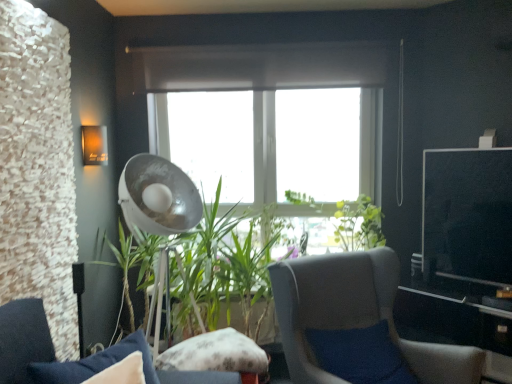
This screenshot has width=512, height=384. Identify the location of metallic silver fan at center. (158, 197).

Where is `matte orange wall sconce at upper left`? Image resolution: width=512 pixels, height=384 pixels. matte orange wall sconce at upper left is located at coordinates (94, 145).

Where is `fluffy fabric pillow at center`? Image resolution: width=512 pixels, height=384 pixels. fluffy fabric pillow at center is located at coordinates (215, 354).

The image size is (512, 384). What are the coordinates of `metallic silver fan at center` in the screenshot? It's located at (158, 197).

Can you confirm if gray fabric chair at center, the 2th chair when ordered from left to right, is positioned to the right of green leafy plant at center?

Indeed, gray fabric chair at center, the 2th chair when ordered from left to right, is positioned on the right side of green leafy plant at center.

From the picture: Does gray fabric chair at center, the 2th chair when ordered from left to right, have a greater width compared to green leafy plant at center?

Indeed, gray fabric chair at center, the 2th chair when ordered from left to right, has a greater width compared to green leafy plant at center.

The height and width of the screenshot is (384, 512). Identify the location of houseplant that is on the left side of gray fabric chair at center, the first chair when ordered from right to left. (210, 264).

Can you confirm if velvet blue cushion at lower left, the 2th chair from the right, is wider than metallic silver fan at center?

Incorrect, the width of velvet blue cushion at lower left, the 2th chair from the right, does not surpass that of metallic silver fan at center.

Where is `the 1st chair counting from the right of the metallic silver fan at center`? The height and width of the screenshot is (384, 512). the 1st chair counting from the right of the metallic silver fan at center is located at coordinates 72,361.

Relative to metallic silver fan at center, is velvet blue cushion at lower left, the 2th chair from the right, in front or behind?

velvet blue cushion at lower left, the 2th chair from the right, is positioned closer to the viewer than metallic silver fan at center.

Locate an element on the screen. pillow that appears in front of the metallic silver fan at center is located at coordinates (215, 354).

Would you say fluffy fabric pillow at center is a long distance from metallic silver fan at center?

No, fluffy fabric pillow at center is not far away from metallic silver fan at center.

Is fluffy fabric pillow at center wider than metallic silver fan at center?

No.

Measure the distance between metallic silver fan at center and matte orange wall sconce at upper left.

A distance of 20.07 inches exists between metallic silver fan at center and matte orange wall sconce at upper left.

Is point (155, 162) closer or farther from the camera than point (85, 126)?

Clearly, point (155, 162) is more distant from the camera than point (85, 126).

From a real-world perspective, is metallic silver fan at center physically located above or below matte orange wall sconce at upper left?

metallic silver fan at center is situated lower than matte orange wall sconce at upper left in the real world.

Is metallic silver fan at center positioned beyond the bounds of matte orange wall sconce at upper left?

metallic silver fan at center is positioned outside matte orange wall sconce at upper left.

From the image's perspective, who appears lower, matte orange wall sconce at upper left or metallic silver fan at center?

metallic silver fan at center, from the image's perspective.

Is matte orange wall sconce at upper left smaller than metallic silver fan at center?

Yes.

Identify the location of mechanical fan that appears in front of the matte orange wall sconce at upper left. (158, 197).

From a real-world perspective, between matte orange wall sconce at upper left and metallic silver fan at center, who is vertically lower?

metallic silver fan at center.

Which is closer, (472, 350) or (101, 133)?

Point (472, 350)

Which of these two, gray fabric chair at center, the first chair when ordered from right to left, or matte orange wall sconce at upper left, stands shorter?

matte orange wall sconce at upper left is shorter.

Is gray fabric chair at center, the 2th chair when ordered from left to right, further to camera compared to matte orange wall sconce at upper left?

No, it is not.

Is gray fabric chair at center, the first chair when ordered from right to left, aimed at matte orange wall sconce at upper left?

No, gray fabric chair at center, the first chair when ordered from right to left, is not oriented towards matte orange wall sconce at upper left.

Who is bigger, gray fabric chair at center, the 2th chair when ordered from left to right, or fluffy fabric pillow at center?

gray fabric chair at center, the 2th chair when ordered from left to right, is bigger.

Is gray fabric chair at center, the 2th chair when ordered from left to right, in contact with fluffy fabric pillow at center?

No, gray fabric chair at center, the 2th chair when ordered from left to right, is not beside fluffy fabric pillow at center.

Which of these two, gray fabric chair at center, the first chair when ordered from right to left, or fluffy fabric pillow at center, stands shorter?

fluffy fabric pillow at center is shorter.

In the image, there is a green leafy plant at center. Identify the location of chair below it (from a real-world perspective). Image resolution: width=512 pixels, height=384 pixels. (355, 315).

Where is `the 2nd chair in front when counting from the metallic silver fan at center`? This screenshot has height=384, width=512. the 2nd chair in front when counting from the metallic silver fan at center is located at coordinates (72, 361).

Which object lies further to the anchor point green leafy plant at center, metallic silver fan at center or fluffy fabric pillow at center?

fluffy fabric pillow at center is further to green leafy plant at center.

Looking at this image, which object lies further to the anchor point fluffy fabric pillow at center, metallic silver fan at center or matte orange wall sconce at upper left?

Based on the image, matte orange wall sconce at upper left appears to be further to fluffy fabric pillow at center.

Which object lies further to the anchor point gray fabric chair at center, the first chair when ordered from right to left, fluffy fabric pillow at center or velvet blue cushion at lower left, arranged as the 1th chair when viewed from the left?

velvet blue cushion at lower left, arranged as the 1th chair when viewed from the left, is positioned further to the anchor gray fabric chair at center, the first chair when ordered from right to left.

When comparing their distances from gray fabric chair at center, the 2th chair when ordered from left to right, does green leafy plant at center or velvet blue cushion at lower left, arranged as the 1th chair when viewed from the left, seem closer?

green leafy plant at center is positioned closer to the anchor gray fabric chair at center, the 2th chair when ordered from left to right.

Based on their spatial positions, is velvet blue cushion at lower left, the 2th chair from the right, or green leafy plant at center closer to matte orange wall sconce at upper left?

Based on the image, green leafy plant at center appears to be nearer to matte orange wall sconce at upper left.

When comparing their distances from green leafy plant at center, does fluffy fabric pillow at center or matte orange wall sconce at upper left seem closer?

fluffy fabric pillow at center lies closer to green leafy plant at center than the other object.

Considering their positions, is metallic silver fan at center positioned closer to fluffy fabric pillow at center than velvet blue cushion at lower left, arranged as the 1th chair when viewed from the left?

velvet blue cushion at lower left, arranged as the 1th chair when viewed from the left.

When comparing their distances from velvet blue cushion at lower left, arranged as the 1th chair when viewed from the left, does green leafy plant at center or matte orange wall sconce at upper left seem closer?

green leafy plant at center.

This screenshot has width=512, height=384. Find the location of `houseplant between metallic silver fan at center and fluffy fabric pillow at center vertically`. houseplant between metallic silver fan at center and fluffy fabric pillow at center vertically is located at coordinates (210, 264).

The width and height of the screenshot is (512, 384). I want to click on pillow between velvet blue cushion at lower left, the 2th chair from the right, and metallic silver fan at center in the front-back direction, so click(215, 354).

Find the location of a particular element. chair between velvet blue cushion at lower left, the 2th chair from the right, and green leafy plant at center in the front-back direction is located at coordinates (355, 315).

Locate an element on the screen. The width and height of the screenshot is (512, 384). mechanical fan between velvet blue cushion at lower left, arranged as the 1th chair when viewed from the left, and green leafy plant at center, along the z-axis is located at coordinates (158, 197).